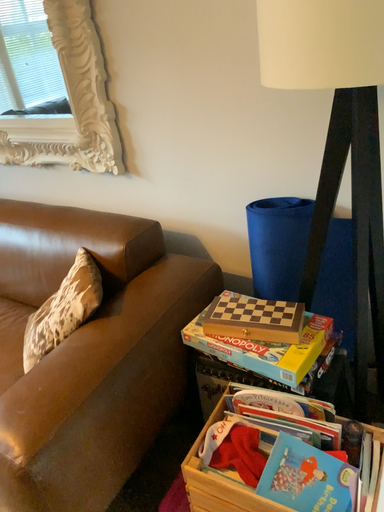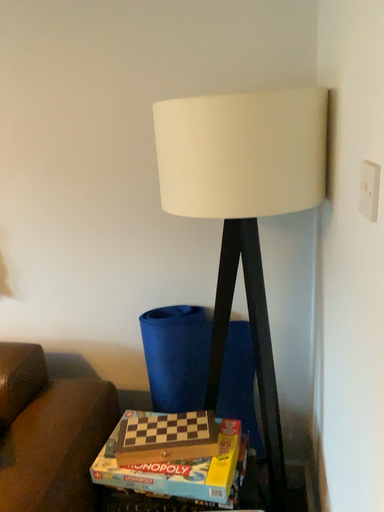
Question: Which way did the camera rotate in the video?

Choices:
 (A) rotated right
 (B) rotated left

Answer: (A)